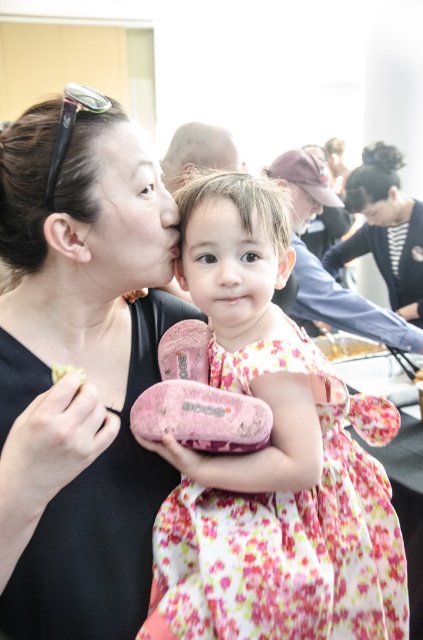
Who is positioned more to the left, black textured hair at upper center or yellow matte plate at center?

yellow matte plate at center is more to the left.

Is point (379, 257) in front of point (335, 340)?

Yes.

Which is in front, point (408, 314) or point (343, 337)?

Point (408, 314)

Find the location of a particular element. The height and width of the screenshot is (640, 423). black textured hair at upper center is located at coordinates (384, 228).

Who is more distant from viewer, [321,477] or [143,202]?

The point [321,477] is behind.

Which is more to the left, pink fabric dress at center or matte skin face at center?

Positioned to the left is matte skin face at center.

Which is behind, point (277, 406) or point (162, 234)?

Positioned behind is point (162, 234).

Image resolution: width=423 pixels, height=640 pixels. Identify the location of pink fabric dress at center. (272, 458).

The height and width of the screenshot is (640, 423). What do you see at coordinates (129, 216) in the screenshot? I see `matte skin face at center` at bounding box center [129, 216].

Is point (96, 243) farther from camera compared to point (261, 252)?

No, it is in front of (261, 252).

Is point (115, 224) more distant than point (200, 248)?

No, it is in front of (200, 248).

Locate an element on the screen. matte skin face at center is located at coordinates (129, 216).